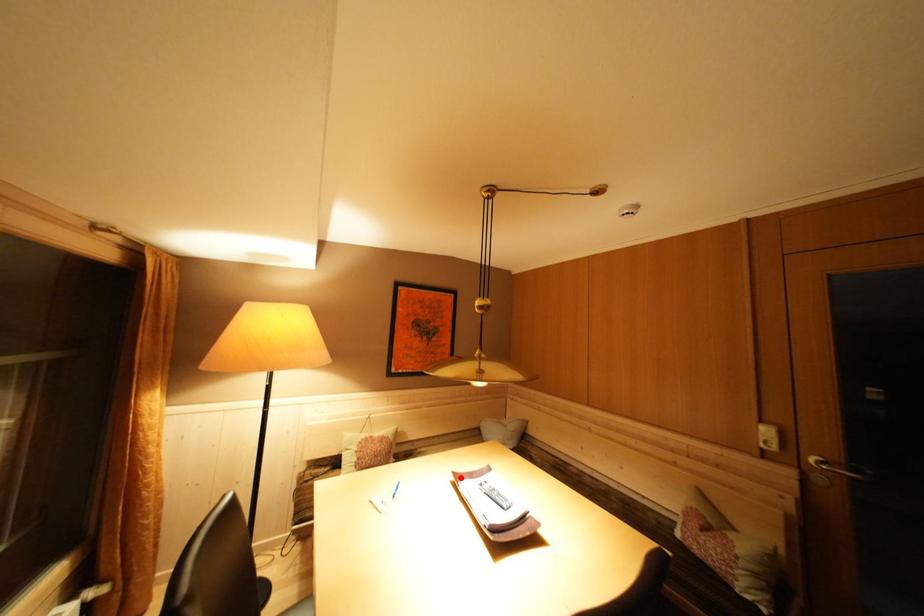
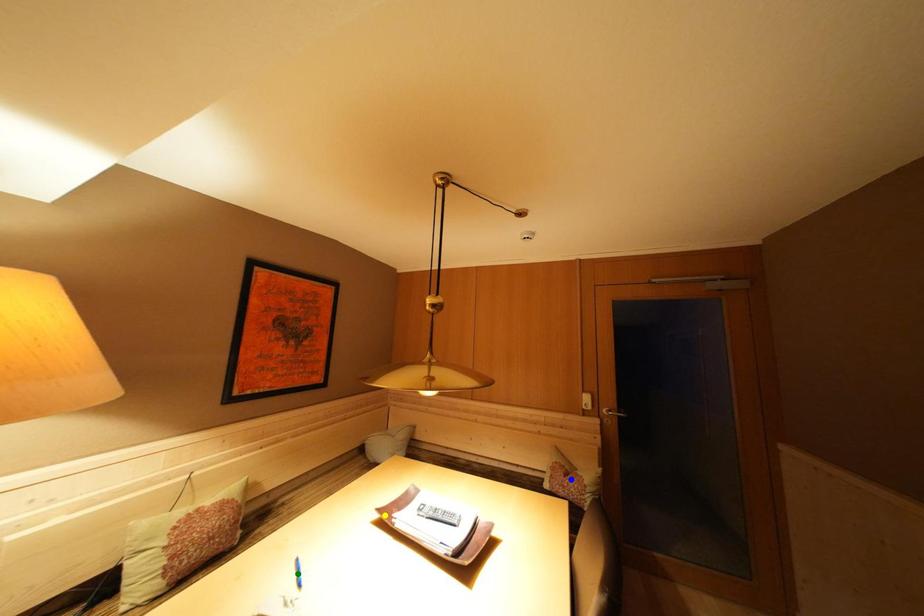
Question: I am providing you with two images of the same scene from different viewpoints. A red point is marked on the first image. You are given multiple points on the second image. In image 2, which mark is for the same physical point as the one in image 1?

Choices:
 (A) blue point
 (B) green point
 (C) yellow point

Answer: (C)